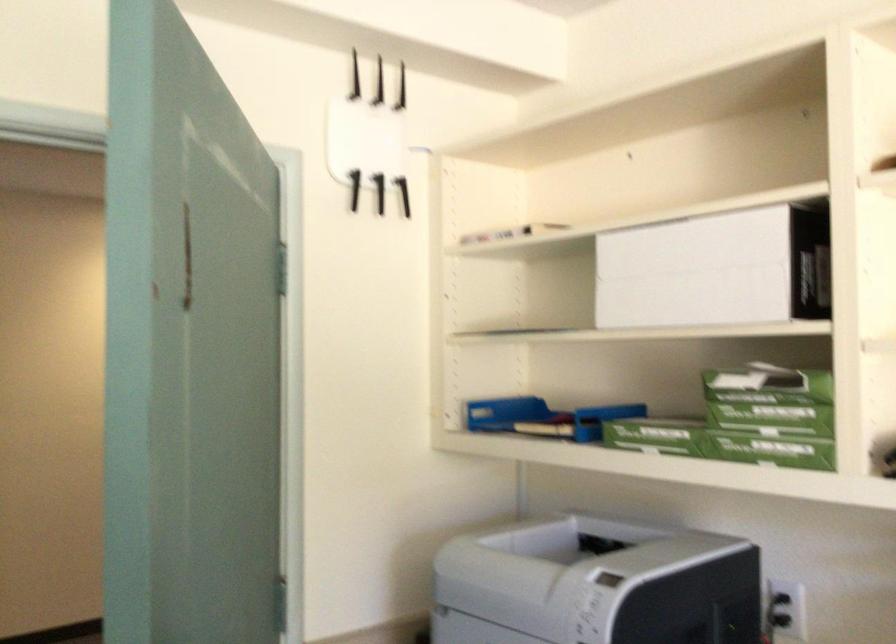
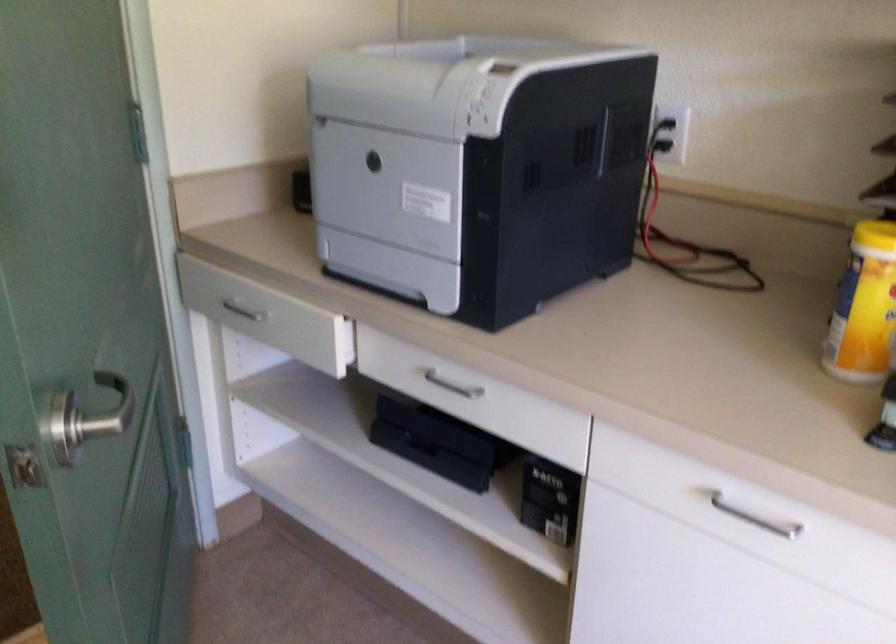
Question: The images are taken continuously from a first-person perspective. In which direction are you moving?

Choices:
 (A) Left
 (B) Right
 (C) Forward
 (D) Backward

Answer: (C)